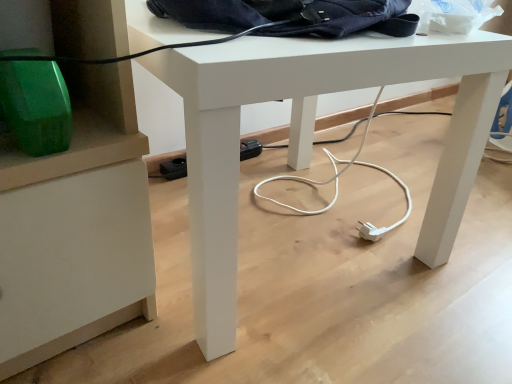
Question: From the image's perspective, is navy blue fabric messenger bag at upper center above white matte desk at center?

Choices:
 (A) yes
 (B) no

Answer: (A)

Question: Is navy blue fabric messenger bag at upper center wider than white matte desk at center?

Choices:
 (A) yes
 (B) no

Answer: (B)

Question: From a real-world perspective, is navy blue fabric messenger bag at upper center on white matte desk at center?

Choices:
 (A) no
 (B) yes

Answer: (B)

Question: Is navy blue fabric messenger bag at upper center turned away from white matte desk at center?

Choices:
 (A) no
 (B) yes

Answer: (A)

Question: Does navy blue fabric messenger bag at upper center have a smaller size compared to white matte desk at center?

Choices:
 (A) yes
 (B) no

Answer: (A)

Question: Does navy blue fabric messenger bag at upper center have a larger size compared to white matte desk at center?

Choices:
 (A) yes
 (B) no

Answer: (B)

Question: Is white matte desk at center further to camera compared to navy blue fabric messenger bag at upper center?

Choices:
 (A) yes
 (B) no

Answer: (B)

Question: Is white matte desk at center to the left of navy blue fabric messenger bag at upper center from the viewer's perspective?

Choices:
 (A) yes
 (B) no

Answer: (A)

Question: Would you consider white matte desk at center to be distant from navy blue fabric messenger bag at upper center?

Choices:
 (A) yes
 (B) no

Answer: (B)

Question: Can you confirm if white matte desk at center is taller than navy blue fabric messenger bag at upper center?

Choices:
 (A) no
 (B) yes

Answer: (B)

Question: Is navy blue fabric messenger bag at upper center inside white matte desk at center?

Choices:
 (A) yes
 (B) no

Answer: (B)

Question: From the image's perspective, is white matte desk at center under navy blue fabric messenger bag at upper center?

Choices:
 (A) no
 (B) yes

Answer: (B)

Question: In terms of width, does navy blue fabric messenger bag at upper center look wider or thinner when compared to white matte desk at center?

Choices:
 (A) thin
 (B) wide

Answer: (A)